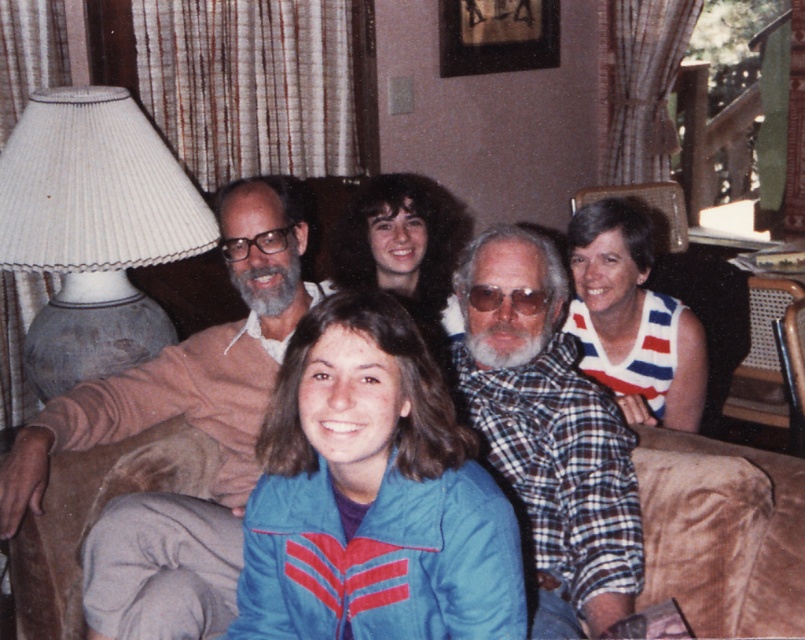
In the scene shown: You are an interior designer planning to place a new lamp next to the white striped sweater at upper right and the dark brown curly hair at center. Which object should the lamp be placed closer to if you want it to be proportionally balanced?

The lamp should be placed closer to the dark brown curly hair at center because the white striped sweater at upper right is smaller in size compared to the dark brown curly hair at center, so balancing their sizes would require the lamp to compensate by being nearer to the larger object.

You are standing in the living room and need to find the white striped sweater at upper right. According to the scene description, where exactly is it positioned?

The white striped sweater at upper right is located at point (632, 320) in the image coordinates.

You are designing a new seating arrangement for the living room and need to ensure that the blue fabric jacket at center and the white striped sweater at upper right have enough space between them. Based on their sizes, what should you consider when placing these two items?

The blue fabric jacket at center is wider than the white striped sweater at upper right. When placing them, ensure there is sufficient space between the two to accommodate the larger width of the blue fabric jacket at center.